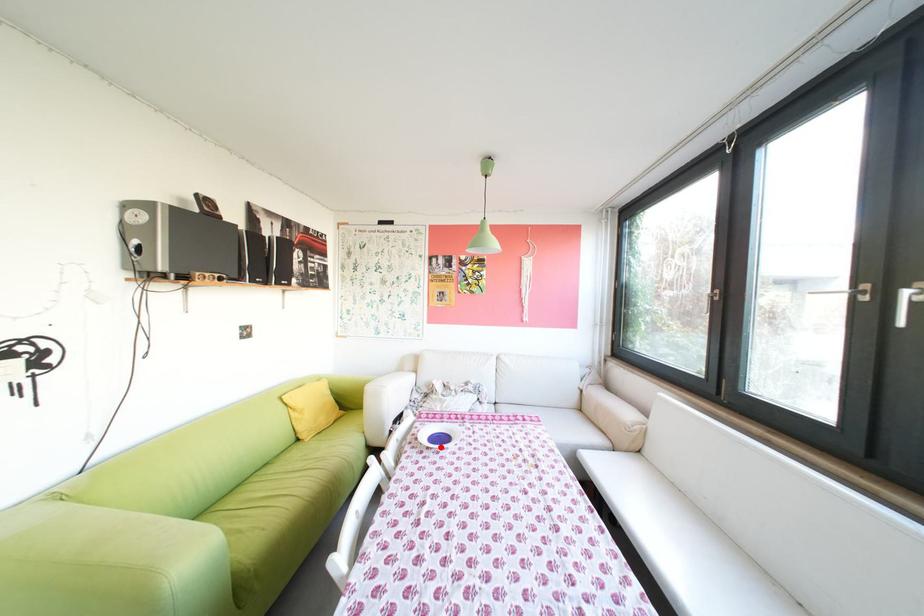
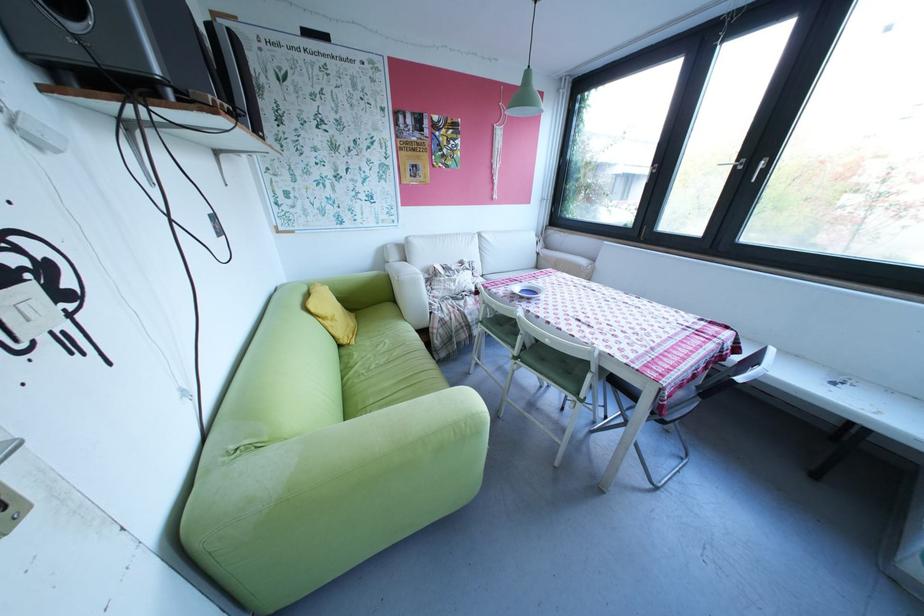
Locate, in the second image, the point that corresponds to the highlighted location in the first image.

(541, 299)